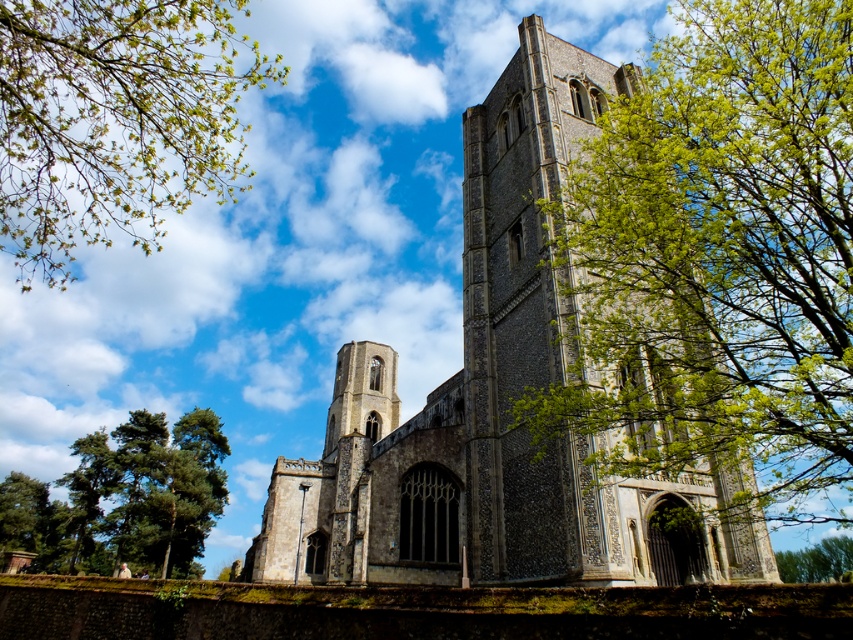
Is green leafy tree at right behind stone church at center?

That is False.

Is point (651, 332) positioned after point (537, 266)?

No, it is in front of (537, 266).

What do you see at coordinates (718, 257) in the screenshot? This screenshot has height=640, width=853. I see `green leafy tree at right` at bounding box center [718, 257].

Where is `green leafy tree at right`? green leafy tree at right is located at coordinates (718, 257).

Is green leafy branches at upper left closer to camera compared to green leafy tree at lower right?

Yes, it is in front of green leafy tree at lower right.

Between point (129, 48) and point (792, 570), which one is positioned in front?

Positioned in front is point (129, 48).

Find the location of `green leafy branches at upper left`. green leafy branches at upper left is located at coordinates (115, 120).

Locate an element on the screen. green leafy branches at upper left is located at coordinates (115, 120).

Between point (198, 108) and point (149, 556), which one is positioned behind?

The point (149, 556) is more distant.

Between green leafy branches at upper left and green textured tree at lower left, which one appears on the right side from the viewer's perspective?

green textured tree at lower left is more to the right.

Between point (54, 32) and point (163, 464), which one is positioned behind?

Point (163, 464)

Where is `green leafy branches at upper left`? green leafy branches at upper left is located at coordinates (115, 120).